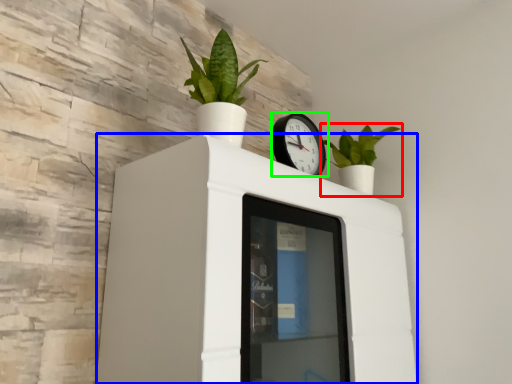
Question: Which object is the closest to the houseplant (highlighted by a red box)? Choose among these: furniture (highlighted by a blue box) or wall clock (highlighted by a green box).

Choices:
 (A) furniture
 (B) wall clock

Answer: (B)